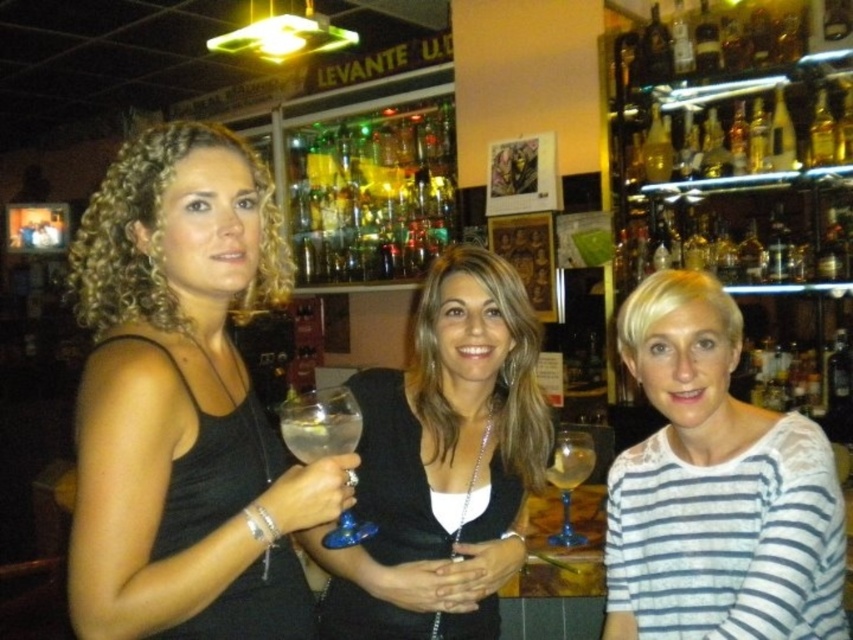
You are a bartender preparing a drink for a customer. You have two wine glasses in front of you, the transparent glass wine glass at center and the clear glass wine glass at center. Which one is positioned higher?

The transparent glass wine glass at center is above the clear glass wine glass at center, so it is positioned higher.

You are a bartender preparing to serve a drink. You have a black matte dress at center and a transparent glass wine glass at center in front of you. Can you place the glass on the dress without it falling off?

The distance between the black matte dress at center and the transparent glass wine glass at center is 8.90 inches. Since the dress is likely flat and stable, the glass can be placed on it without falling off.